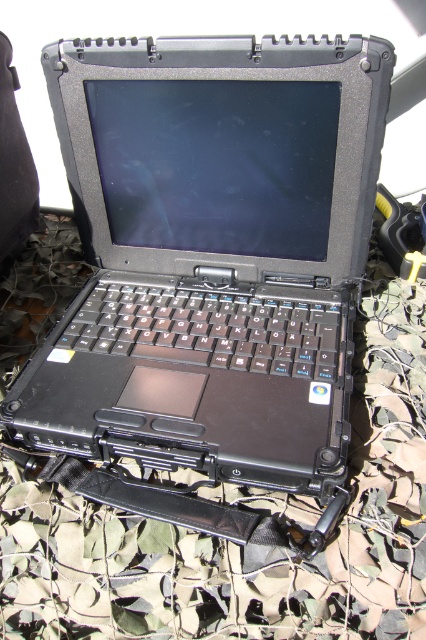
You need to place a protective cover over the black matte laptop at center and the camouflage fabric at center. Which object requires a larger cover?

The camouflage fabric at center requires a larger cover because the black matte laptop at center is smaller in size compared to it.

You are a field technician assessing the setup of a ruggedized laptop. You notice the black matte laptop at center and the camouflage fabric at center. Which object occupies more vertical space in this setup?

The black matte laptop at center is much taller than the camouflage fabric at center, so it occupies more vertical space.